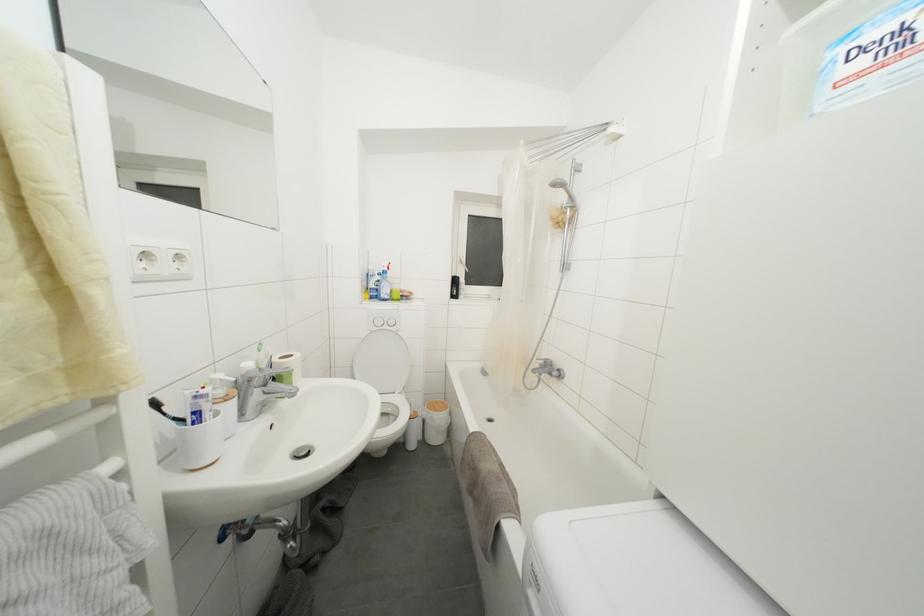
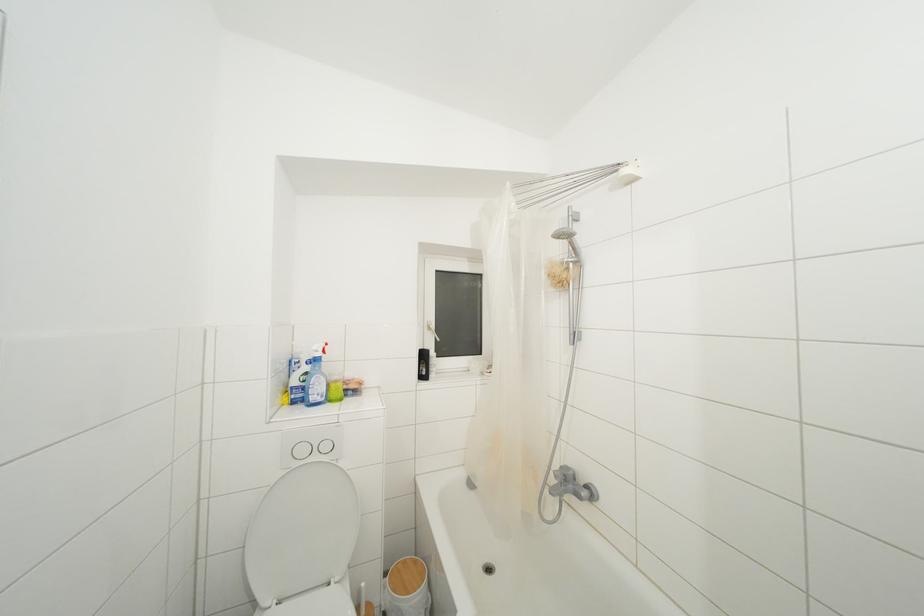
Where in the second image is the point corresponding to (x=575, y=200) from the first image?

(578, 254)